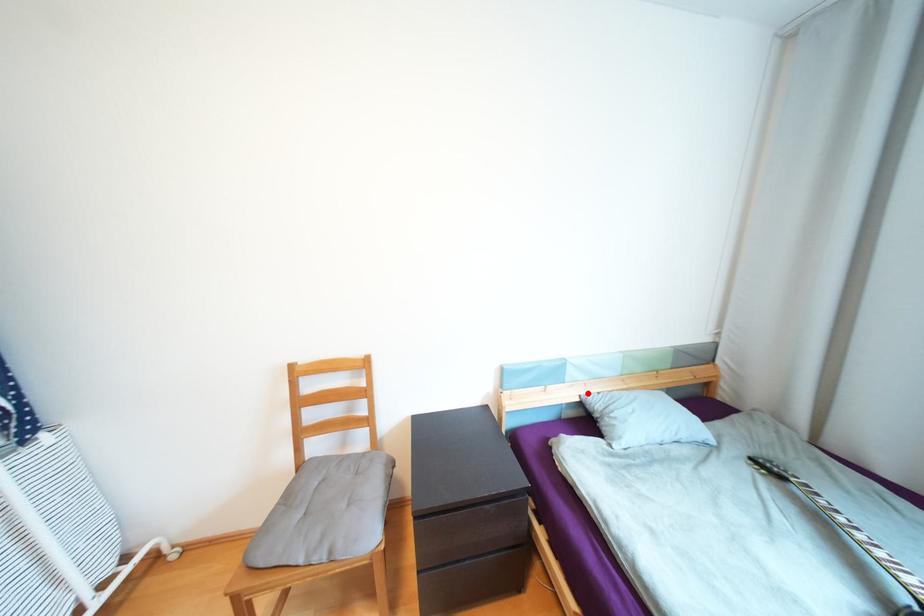
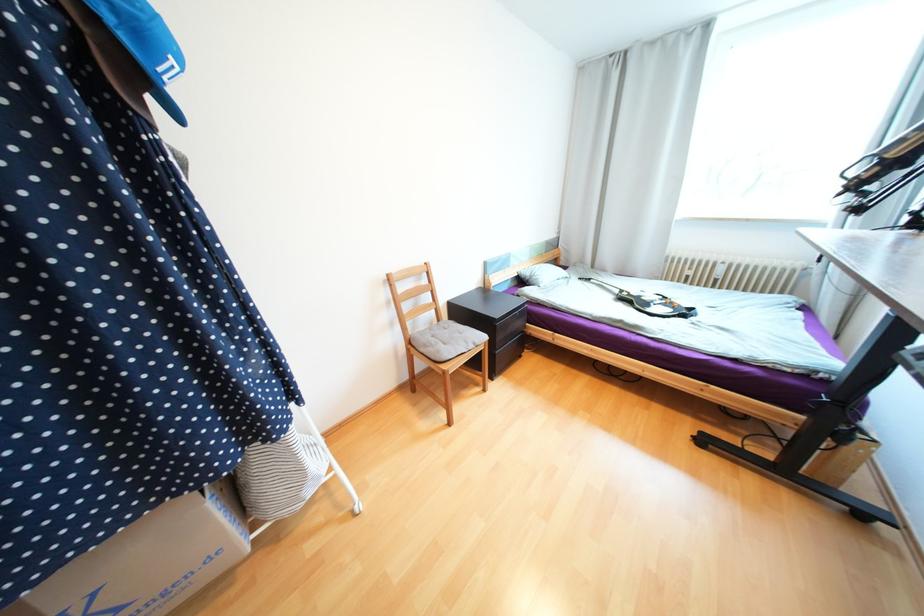
Question: I am providing you with two images of the same scene from different viewpoints. Given a red point in image1, look at the same physical point in image2. Is it:

Choices:
 (A) Closer to the viewpoint
 (B) Farther from the viewpoint

Answer: (A)